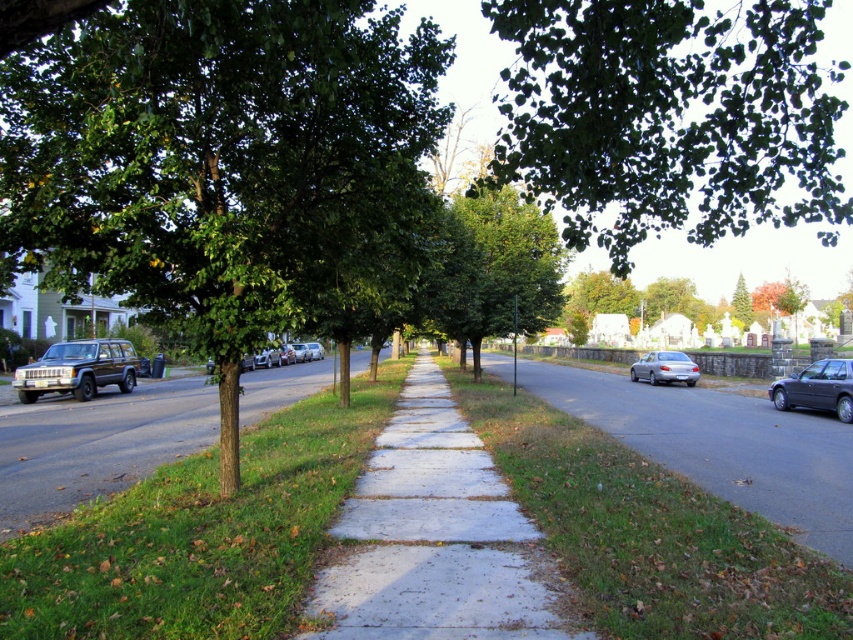
In the scene shown: Who is taller, green leafy tree at center or matte black suv at left?

green leafy tree at center

From the picture: Is the position of green leafy tree at center less distant than that of matte black suv at left?

That is True.

This screenshot has width=853, height=640. What do you see at coordinates (495, 268) in the screenshot?
I see `green leafy tree at center` at bounding box center [495, 268].

Locate an element on the screen. This screenshot has width=853, height=640. green leafy tree at center is located at coordinates (495, 268).

Is green leafy tree at center below shiny black sedan at right?

Actually, green leafy tree at center is above shiny black sedan at right.

Between green leafy tree at center and shiny black sedan at right, which one is positioned higher?

green leafy tree at center

Which is in front, point (476, 218) or point (838, 412)?

Point (838, 412) is in front.

You are a GUI agent. You are given a task and a screenshot of the screen. Output one action in this format:
    pyautogui.click(x=<x>, y=<y>)
    Task: Click on the green leafy tree at center
    The image size is (853, 640).
    Given the screenshot: What is the action you would take?
    pyautogui.click(x=495, y=268)

Between point (672, 84) and point (730, 460), which one is positioned behind?

Point (730, 460)

Between green leafy tree at upper center and gray asphalt sidewalk at center, which one appears on the right side from the viewer's perspective?

From the viewer's perspective, green leafy tree at upper center appears more on the right side.

In order to click on green leafy tree at upper center in this screenshot , I will do `click(668, 116)`.

At what (x,y) coordinates should I click in order to perform the action: click on green leafy tree at upper center. Please return your answer as a coordinate pair (x, y). The width and height of the screenshot is (853, 640). Looking at the image, I should click on (668, 116).